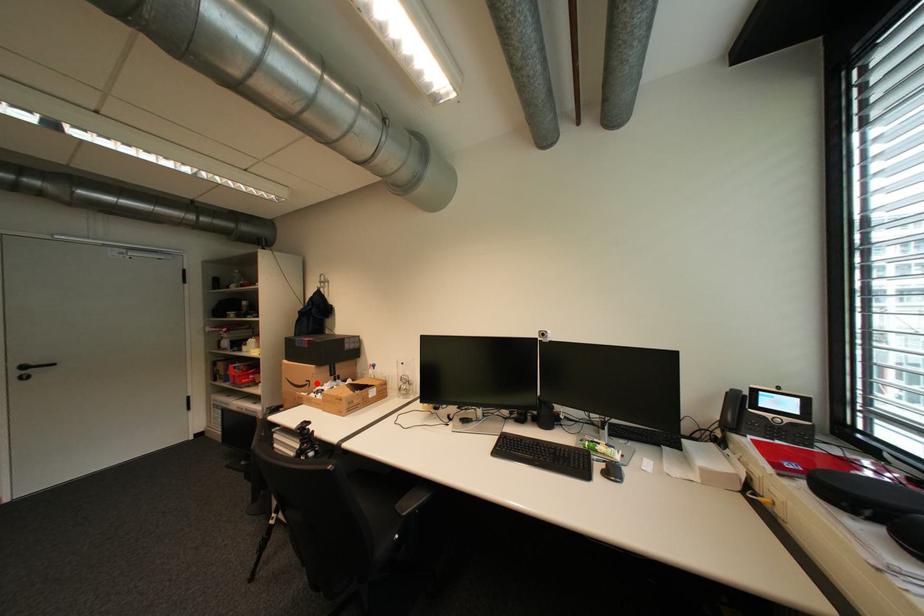
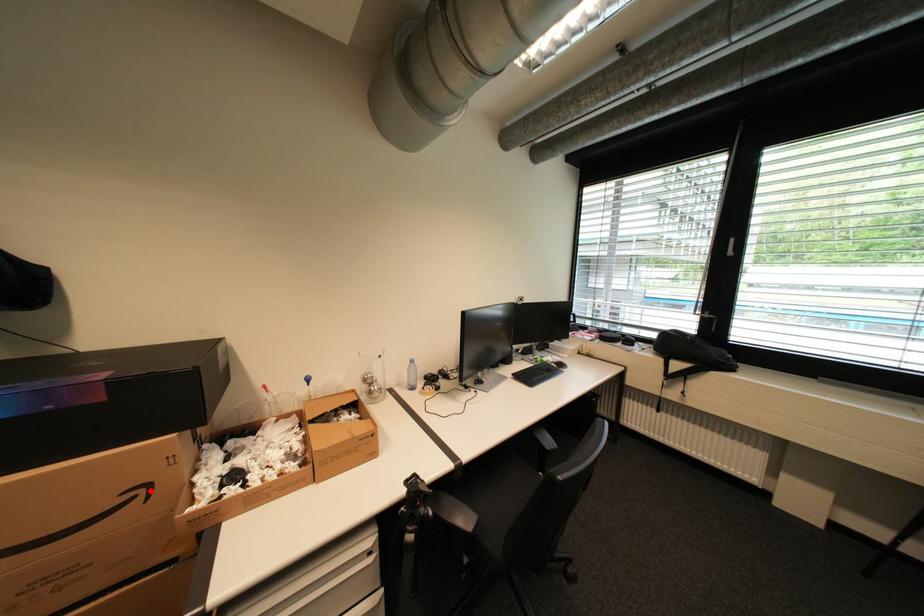
I am providing you with two images of the same scene from different viewpoints. A red point is marked on the first image and another point is marked on the second image. Are the points marked in image1 and image2 representing the same 3D position?

Yes